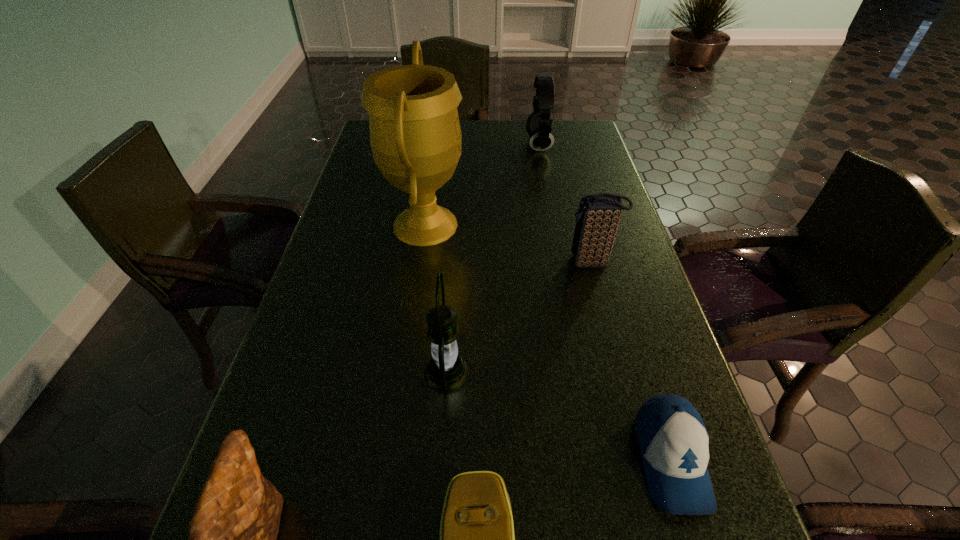
Locate an element on the screen. Image resolution: width=960 pixels, height=540 pixels. the tallest object is located at coordinates (415, 136).

The width and height of the screenshot is (960, 540). What are the coordinates of `the sixth shortest object` in the screenshot? It's located at (446, 372).

At what (x,y) coordinates should I click in order to perform the action: click on lantern. Please return your answer as a coordinate pair (x, y). The image size is (960, 540). Looking at the image, I should click on (446, 372).

The image size is (960, 540). Find the location of `the farthest object`. the farthest object is located at coordinates (538, 125).

This screenshot has height=540, width=960. I want to click on the farthest clutch bag, so click(598, 217).

This screenshot has height=540, width=960. In order to click on baseball cap in this screenshot , I will do `click(672, 438)`.

This screenshot has width=960, height=540. What are the coordinates of `free location located 0.350m on the engravings side of the tallest object` in the screenshot? It's located at (600, 225).

The width and height of the screenshot is (960, 540). I want to click on vacant space situated on the side where the fourth farthest object emits light, so click(590, 373).

What are the coordinates of `vacant space located on the ear cups of the farthest object` in the screenshot? It's located at (474, 145).

Where is `free region located on the ear cups of the farthest object`? The width and height of the screenshot is (960, 540). free region located on the ear cups of the farthest object is located at coordinates (414, 145).